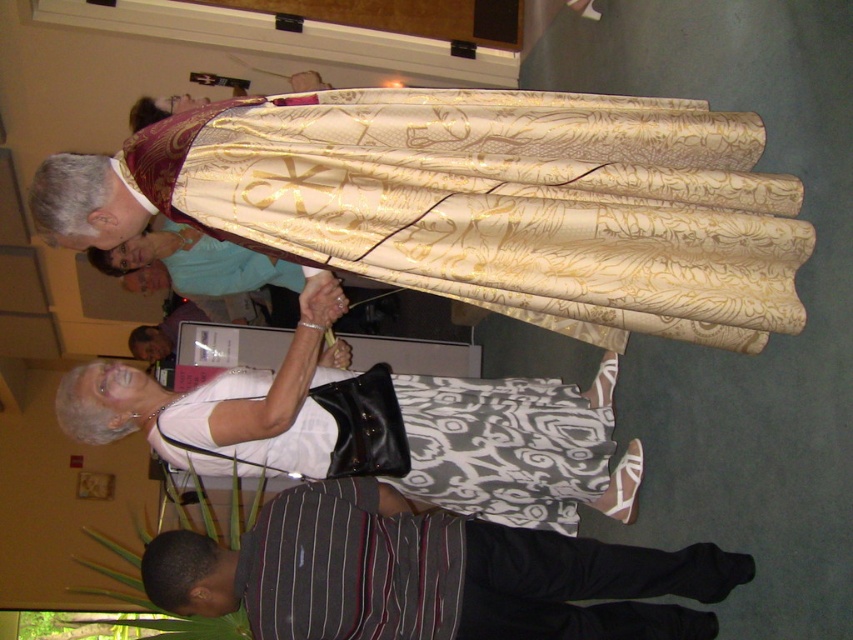
Question: Is striped cotton shirt at lower center above striped cotton shirt at center?

Choices:
 (A) yes
 (B) no

Answer: (B)

Question: Does striped cotton shirt at lower center appear over striped cotton shirt at center?

Choices:
 (A) no
 (B) yes

Answer: (A)

Question: Which object is farther from the camera taking this photo?

Choices:
 (A) striped cotton shirt at lower center
 (B) striped cotton shirt at center

Answer: (B)

Question: Is striped cotton shirt at lower center below striped cotton shirt at center?

Choices:
 (A) yes
 (B) no

Answer: (A)

Question: Which point is closer to the camera?

Choices:
 (A) (421, 461)
 (B) (463, 592)

Answer: (B)